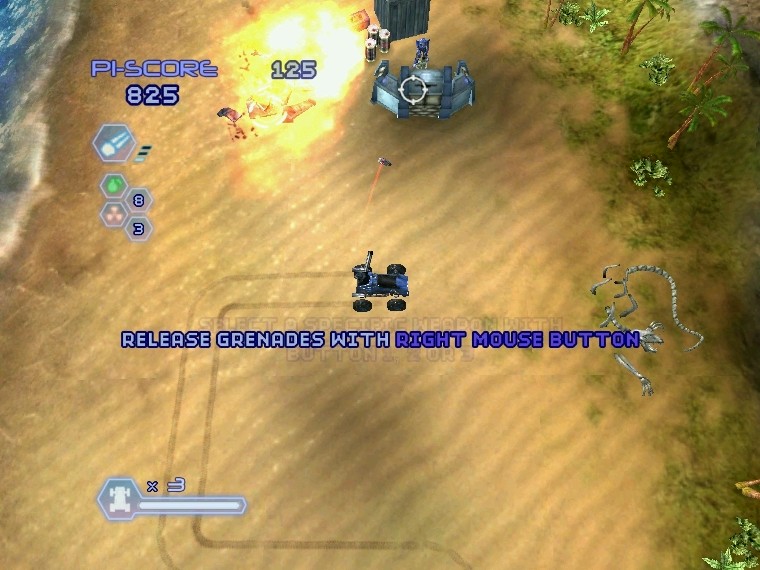
Identify the location of mouse (text). (521, 342).